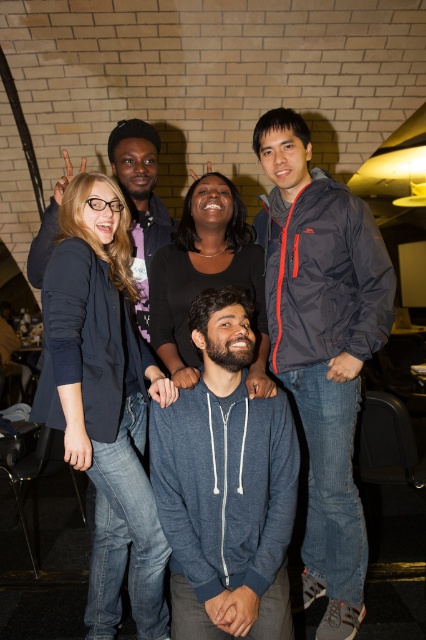
Between navy blue jacket at upper right and dark blue denim jeans at center, which one appears on the left side from the viewer's perspective?

dark blue denim jeans at center is more to the left.

Is navy blue jacket at upper right below dark blue denim jeans at center?

No, navy blue jacket at upper right is not below dark blue denim jeans at center.

Does point (339, 252) come farther from viewer compared to point (81, 428)?

Yes, point (339, 252) is farther from viewer.

You are a GUI agent. You are given a task and a screenshot of the screen. Output one action in this format:
    pyautogui.click(x=<x>, y=<y>)
    Task: Click on the navy blue jacket at upper right
    The image size is (426, 640).
    Given the screenshot: What is the action you would take?
    pyautogui.click(x=322, y=346)

Does navy blue jacket at upper right have a lesser height compared to blue hoodie at center?

In fact, navy blue jacket at upper right may be taller than blue hoodie at center.

Is point (327, 234) farther from viewer compared to point (244, 284)?

That is False.

The height and width of the screenshot is (640, 426). Find the location of `navy blue jacket at upper right`. navy blue jacket at upper right is located at coordinates (322, 346).

Who is lower down, dark blue fleece at center or dark blue denim jeans at center?

dark blue fleece at center is below.

Can you confirm if dark blue fleece at center is smaller than dark blue denim jeans at center?

Correct, dark blue fleece at center occupies less space than dark blue denim jeans at center.

Does point (290, 461) come in front of point (97, 508)?

Yes, it is in front of point (97, 508).

Identify the location of dark blue fleece at center. This screenshot has height=640, width=426. (226, 484).